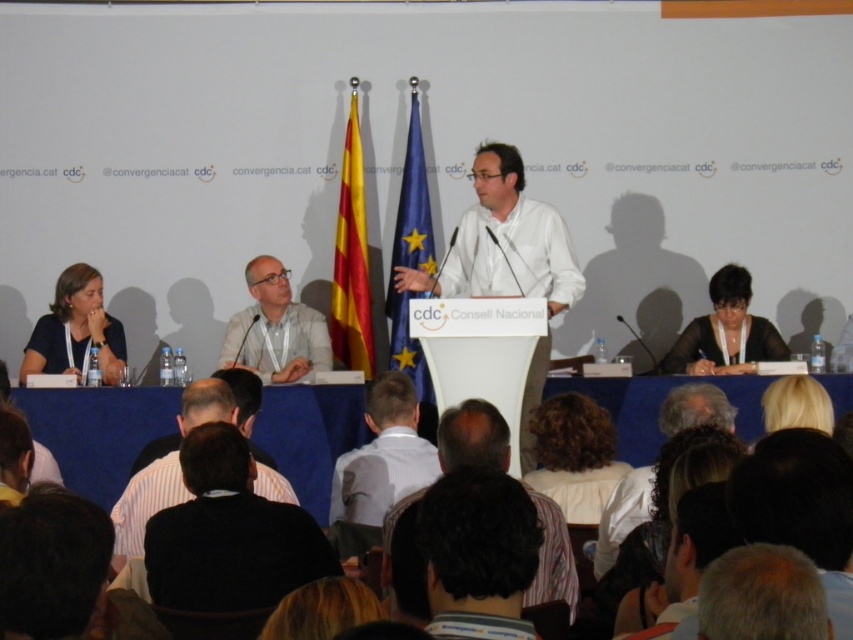
You are attending the event and want to take a photo of the speaker. The speaker has dark brown hair at center and is standing next to a matte black woman at left. Which one is positioned to the right side of the other?

The dark brown hair at center is positioned to the right of the matte black woman at left.

You are attending the event and want to know how far you are from the speaker. The speaker is standing at point (497, 266). Can you determine the distance?

The distance between point (497, 266) and the viewer is 21.92 feet.

Looking at this image, you are an attendee at the conference and want to take a photo of the speaker. You are standing at point (392, 387). If you move to point (494, 189), will the speaker be more visible in your photo?

Point (494, 189) is behind point (392, 387), so moving to point (494, 189) would place you behind the speaker, making them less visible in your photo.